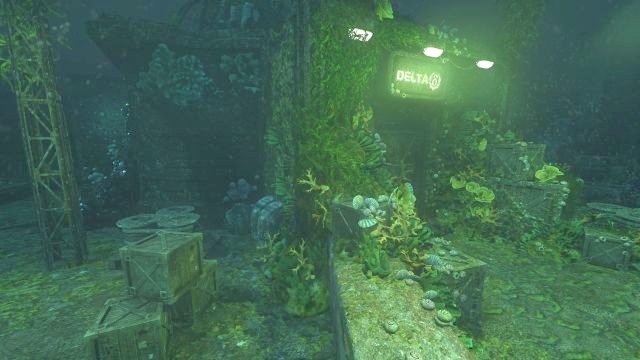
At what (x,y) coordinates should I click in order to perform the action: click on 3 bright white lights reflecting downward. Please return your answer as a coordinate pair (x, y). Image resolution: width=640 pixels, height=360 pixels. Looking at the image, I should click on (433, 52), (480, 66), (356, 36).